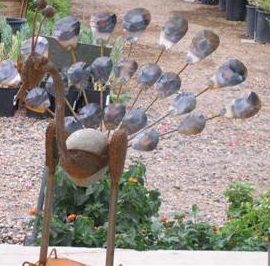
Where is `pot`? The width and height of the screenshot is (270, 266). pot is located at coordinates (10, 24), (265, 23), (250, 11), (239, 5), (224, 7).